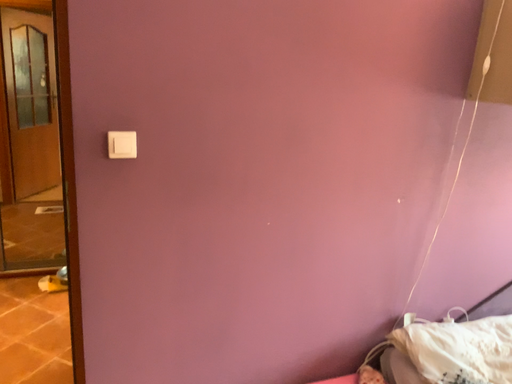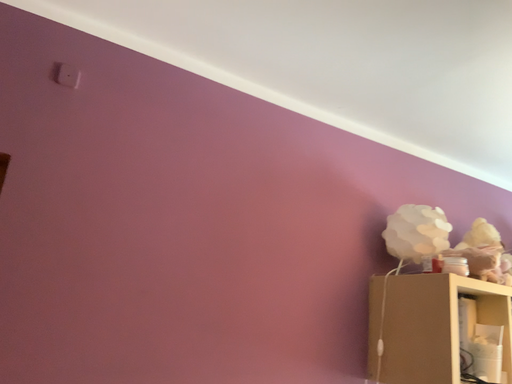
Question: How did the camera likely rotate when shooting the video?

Choices:
 (A) rotated downward
 (B) rotated upward

Answer: (B)